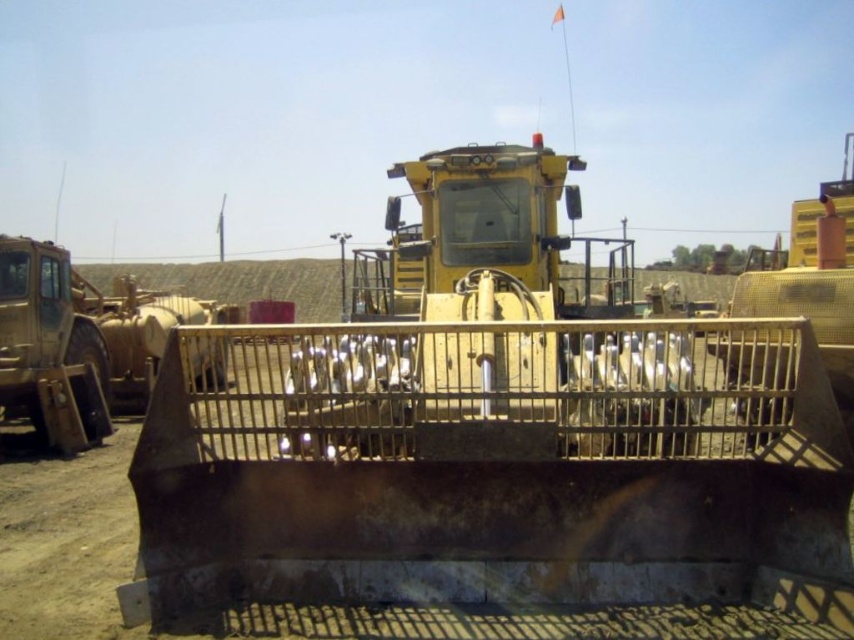
Question: Can you confirm if metallic/textured rail at center is bigger than matte yellow tractor at left?

Choices:
 (A) yes
 (B) no

Answer: (A)

Question: In this image, where is metallic/textured rail at center located relative to matte yellow tractor at left?

Choices:
 (A) above
 (B) below

Answer: (B)

Question: From the image, what is the correct spatial relationship of metallic/textured rail at center in relation to matte yellow tractor at left?

Choices:
 (A) left
 (B) right

Answer: (B)

Question: Which of the following is the closest to the observer?

Choices:
 (A) matte yellow tractor at left
 (B) metallic/textured rail at center

Answer: (B)